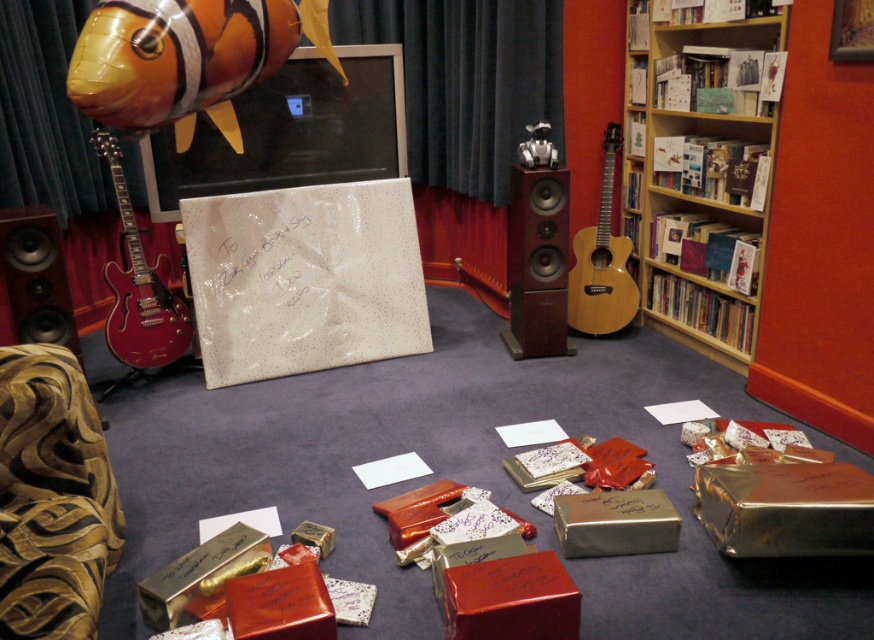
You are a guest in the room and want to place a small gift on the floor near the glossy wood guitar at left without moving the orange and black inflatable fish at upper left. Is this possible?

The orange and black inflatable fish at upper left is above the glossy wood guitar at left, so placing a small gift on the floor near the glossy wood guitar at left is possible without disturbing the inflatable fish since they are at different heights.

You are standing in the living room and see the point at coordinates (786, 508). Which object is this point located on?

The point at coordinates (786, 508) is located on the gold metallic box at lower right.